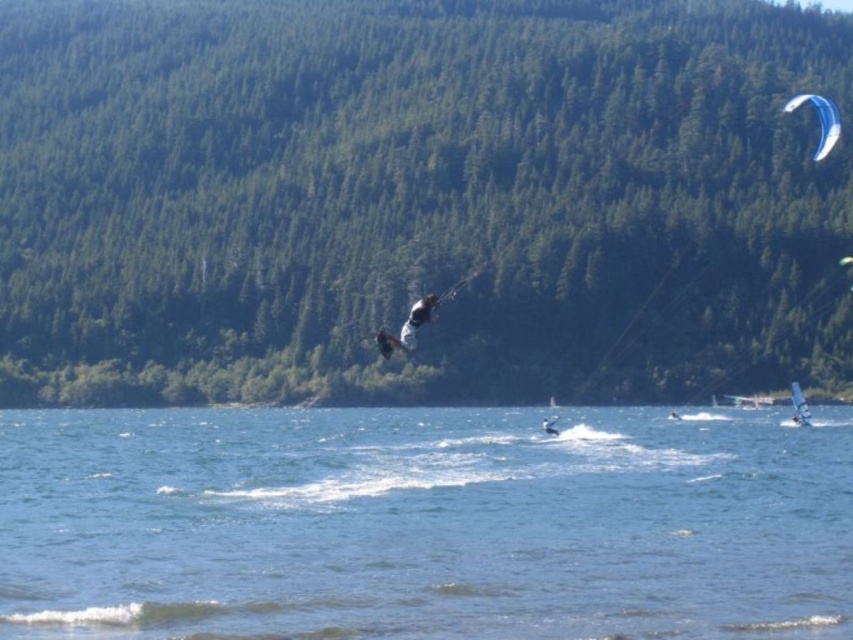
Question: Which point is closer to the camera taking this photo?

Choices:
 (A) [x=419, y=316]
 (B) [x=543, y=424]
 (C) [x=737, y=561]

Answer: (C)

Question: Among these objects, which one is nearest to the camera?

Choices:
 (A) clear blue water at center
 (B) white fabric kite at center
 (C) blue glossy parachute at upper right
 (D) white matte surfboard at center

Answer: (A)

Question: Does white fabric kite at center appear on the right side of blue glossy parachute at upper right?

Choices:
 (A) yes
 (B) no

Answer: (B)

Question: Is the position of clear blue water at center more distant than that of white fabric kite at center?

Choices:
 (A) no
 (B) yes

Answer: (A)

Question: Can you confirm if white fabric kite at center is smaller than white matte surfboard at center?

Choices:
 (A) no
 (B) yes

Answer: (B)

Question: Estimate the real-world distances between objects in this image. Which object is farther from the white matte surfboard at center?

Choices:
 (A) white fabric kite at center
 (B) clear blue water at center
 (C) blue glossy parachute at upper right

Answer: (C)